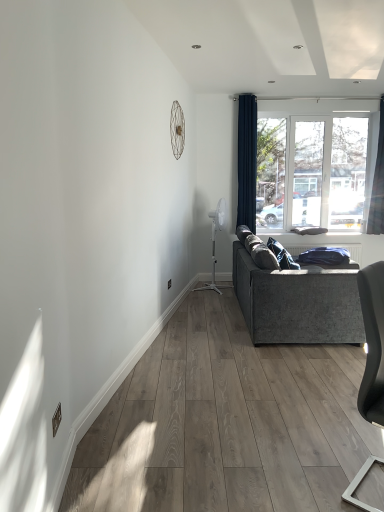
The image size is (384, 512). I want to click on free space that is to the left of matte gray chair at lower right, so click(x=304, y=474).